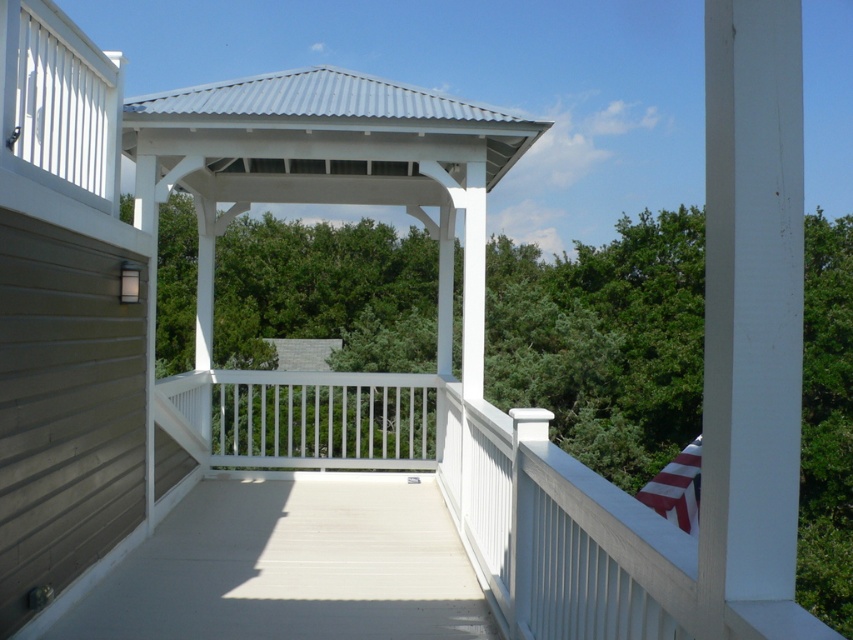
You are standing on the white matte deck at center and want to place a small potted plant on the edge. Considering the height of the white painted wood balustrade at center, will the plant be visible from below the deck? Please explain.

The white matte deck at center is not as tall as the white painted wood balustrade at center. Since the balustrade is taller, the plant placed on the deck edge will be partially obscured by the balustrade from below.

You are standing in the gazebo and want to place a potted plant on the closest surface. Which surface should you choose between the white matte deck at center and the striped fabric flag at lower right?

The white matte deck at center is closer to the viewer than the striped fabric flag at lower right, so you should place the potted plant on the white matte deck at center.

You are planning to install a new flagpole in the deck area. The current striped fabric flag at lower right is smaller than the white painted wood balustrade at center. Which object should you consider in terms of size when choosing the appropriate flagpole size?

The striped fabric flag at lower right is smaller than the white painted wood balustrade at center, so you should consider the size of the striped fabric flag at lower right when choosing the appropriate flagpole size since it is the smaller object.